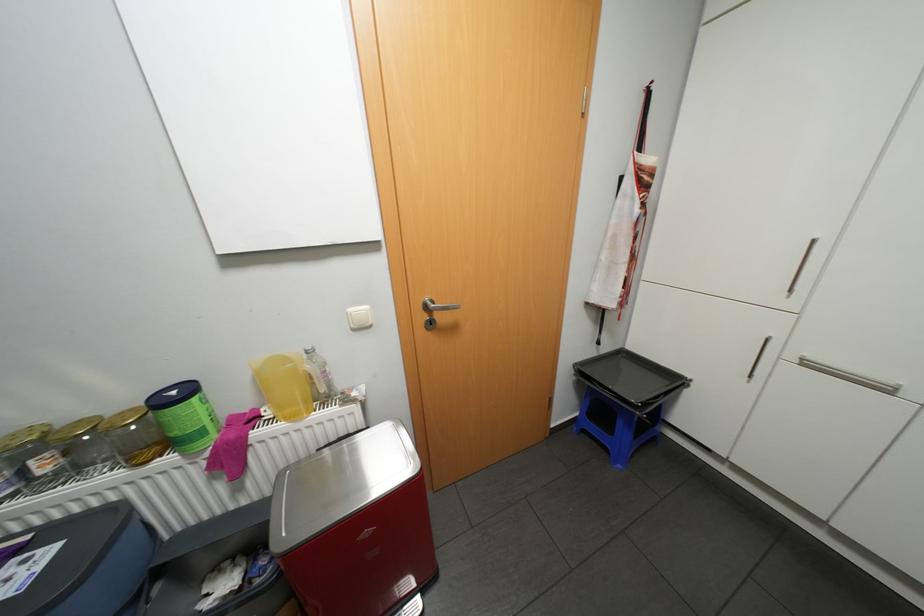
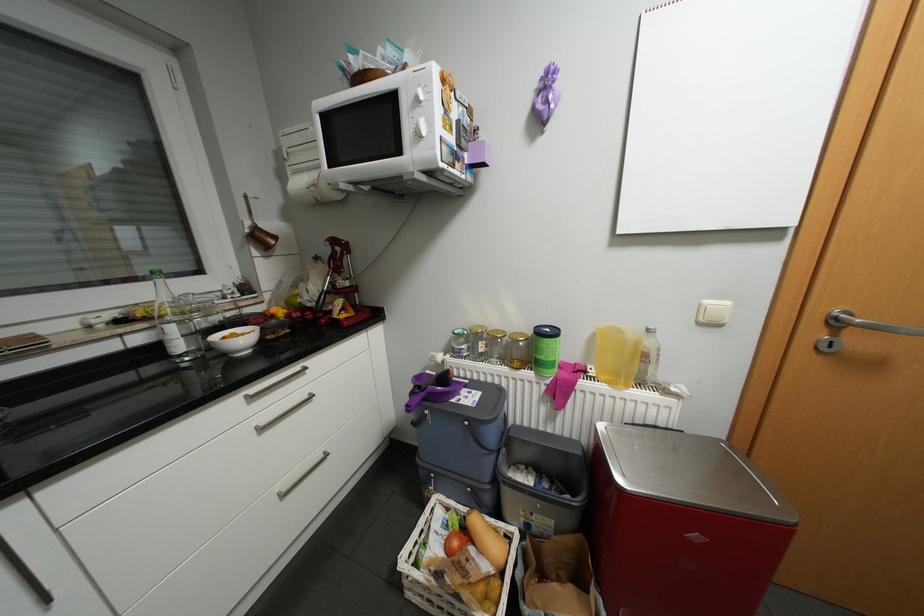
In the second image, find the point that corresponds to the point at 275,413 in the first image.

(600, 371)